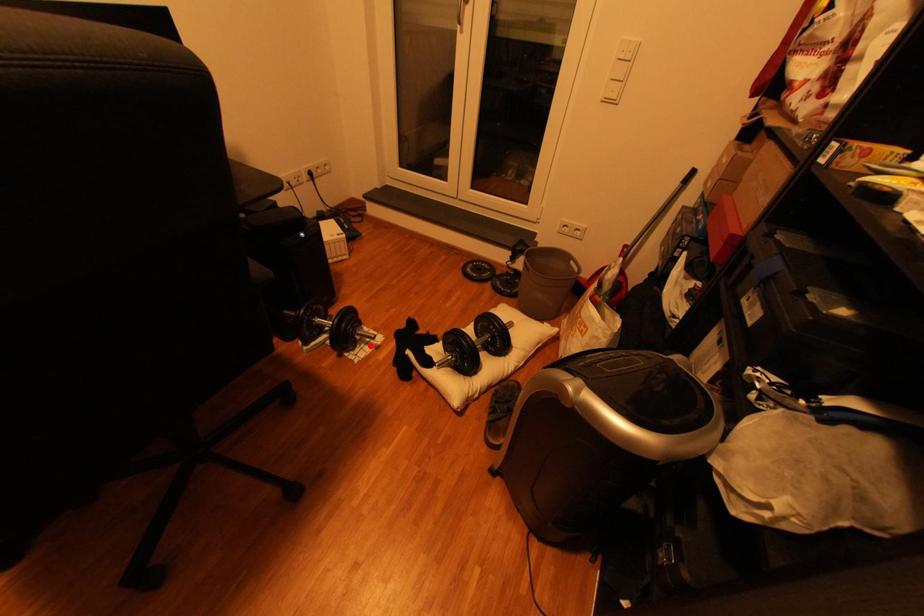
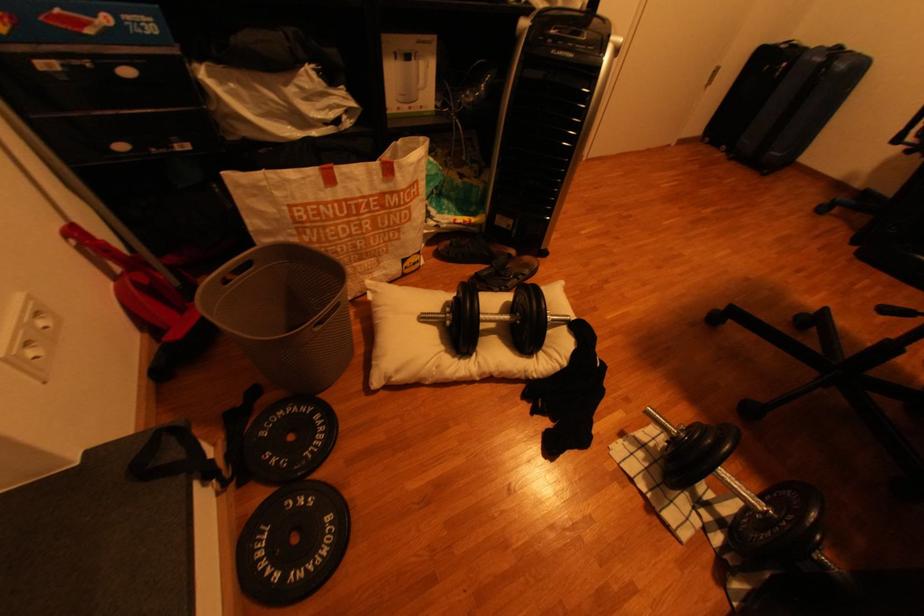
Where in the second image is the point corresponding to the highlighted location from the first image?

(665, 446)